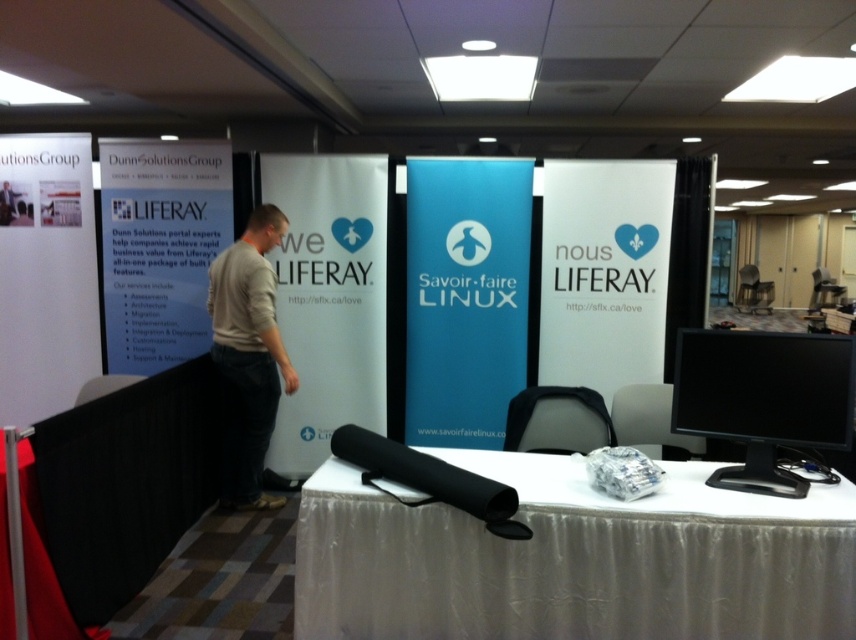
Is white paperboard sign at center to the right of gray cotton shirt at center from the viewer's perspective?

Correct, you'll find white paperboard sign at center to the right of gray cotton shirt at center.

Does point (611, 256) come closer to viewer compared to point (275, 497)?

No.

Where is `white paperboard sign at center`? The width and height of the screenshot is (856, 640). white paperboard sign at center is located at coordinates (604, 272).

From the picture: Which of these two, white paper at upper left or black glossy monitor at right, stands shorter?

Standing shorter between the two is black glossy monitor at right.

Who is positioned more to the right, white paper at upper left or black glossy monitor at right?

From the viewer's perspective, black glossy monitor at right appears more on the right side.

At what (x,y) coordinates should I click in order to perform the action: click on white paper at upper left. Please return your answer as a coordinate pair (x, y). Looking at the image, I should click on (159, 246).

Which is below, white fabric banner at center or white paperboard sign at center?

white fabric banner at center is lower down.

Who is higher up, white fabric banner at center or white paperboard sign at center?

white paperboard sign at center is above.

Is point (352, 204) behind point (637, 344)?

Yes, it is.

Locate an element on the screen. white fabric banner at center is located at coordinates (328, 300).